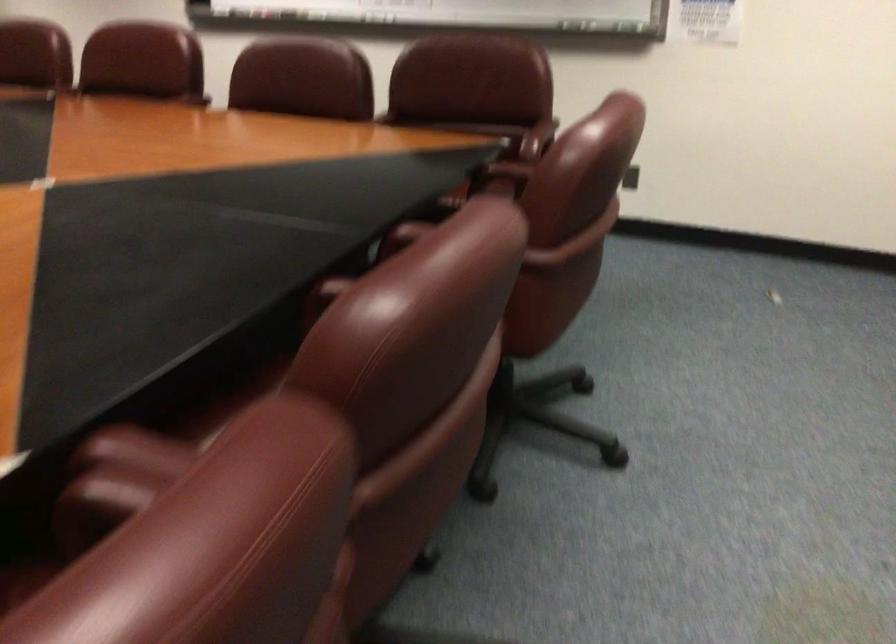
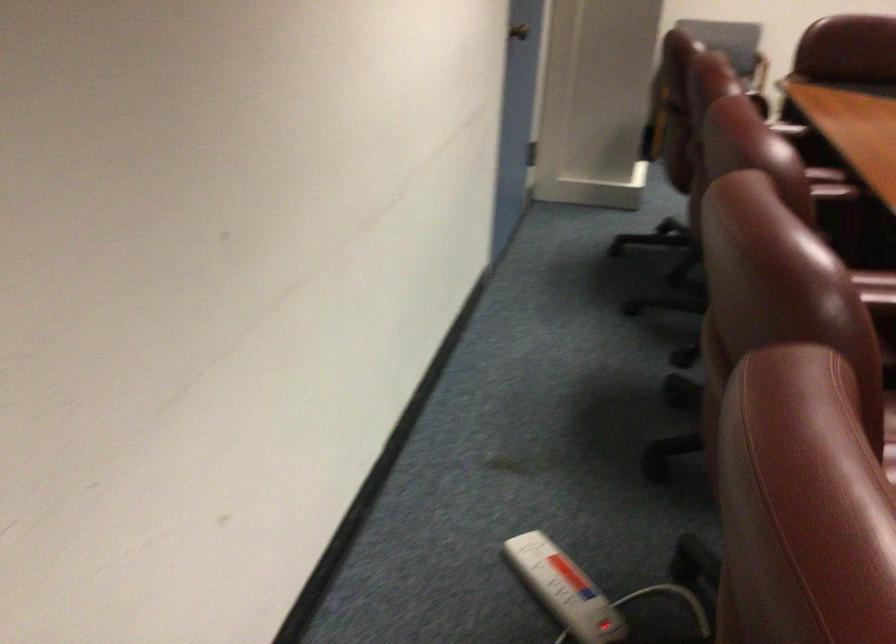
Based on the continuous images, in which direction is the camera rotating?

The camera's rotation is toward right-down.